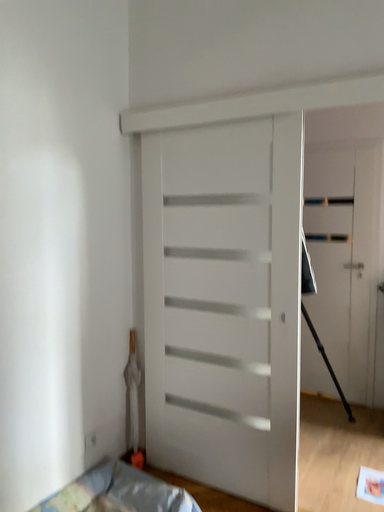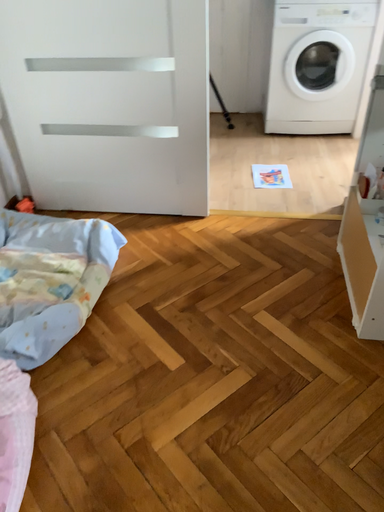
Question: How did the camera likely rotate when shooting the video?

Choices:
 (A) rotated downward
 (B) rotated upward

Answer: (A)